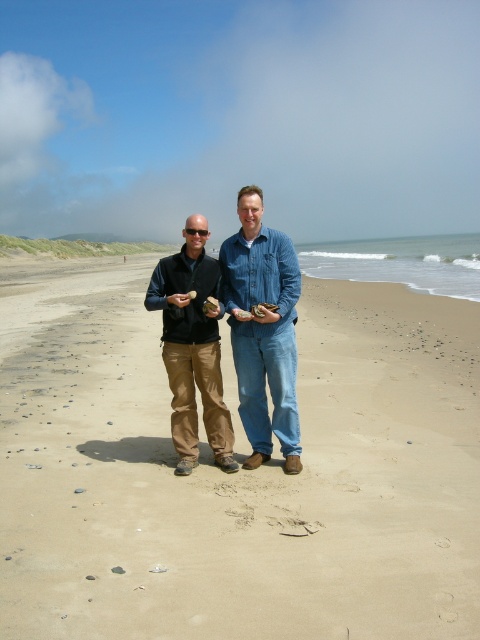
Question: Is smooth sand at center to the left of denim jeans at center from the viewer's perspective?

Choices:
 (A) no
 (B) yes

Answer: (B)

Question: Which point is farther from the camera taking this photo?

Choices:
 (A) (277, 435)
 (B) (187, 326)

Answer: (A)

Question: Can you confirm if smooth sand at center is positioned below denim jeans at center?

Choices:
 (A) no
 (B) yes

Answer: (A)

Question: Which object appears farthest from the camera in this image?

Choices:
 (A) denim jeans at center
 (B) smooth sand at center

Answer: (A)

Question: Can you confirm if denim jeans at center is smaller than khaki cotton pants at center?

Choices:
 (A) no
 (B) yes

Answer: (A)

Question: Among these points, which one is farthest from the camera?

Choices:
 (A) (178, 404)
 (B) (262, 250)
 (C) (349, 476)

Answer: (A)